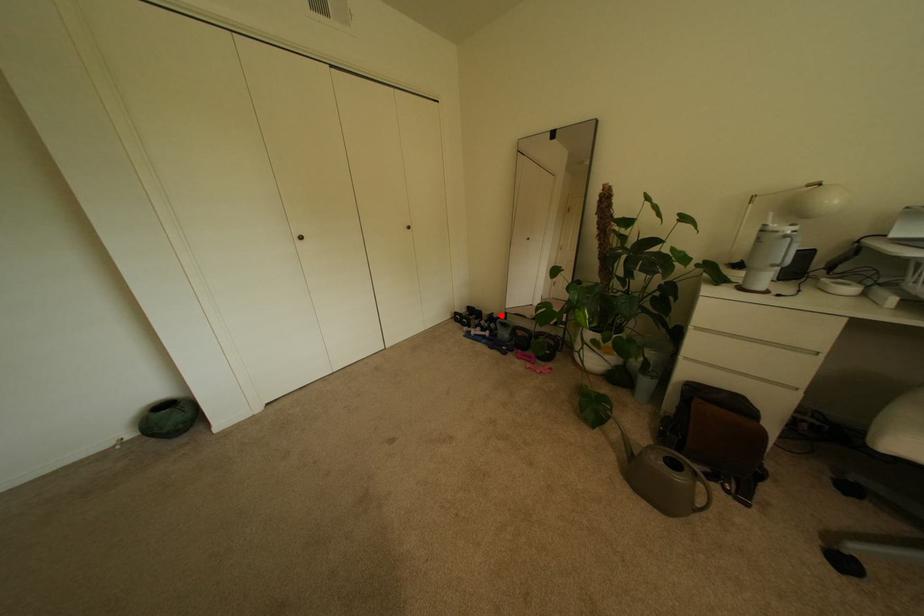
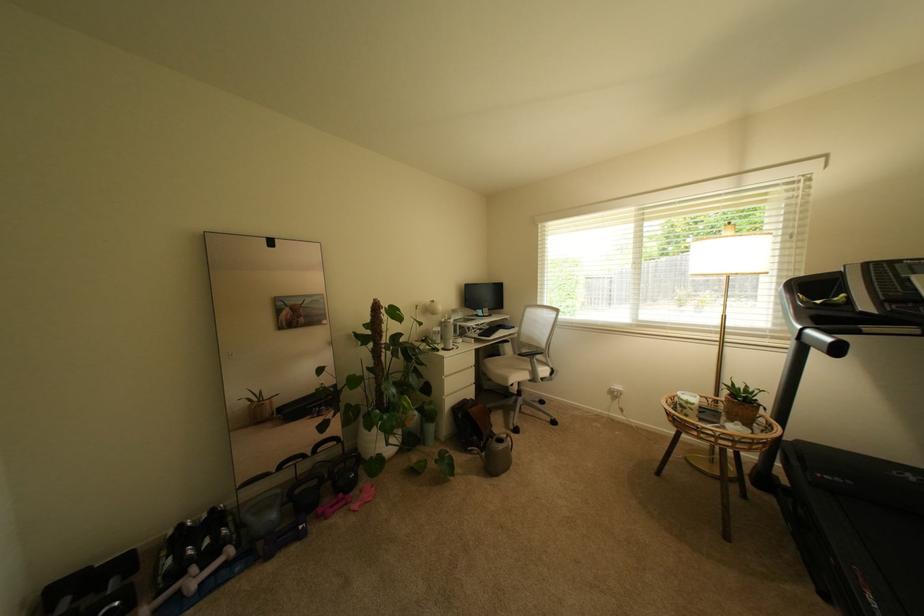
Find the pixel in the second image that matches the highlighted location in the first image.

(188, 527)